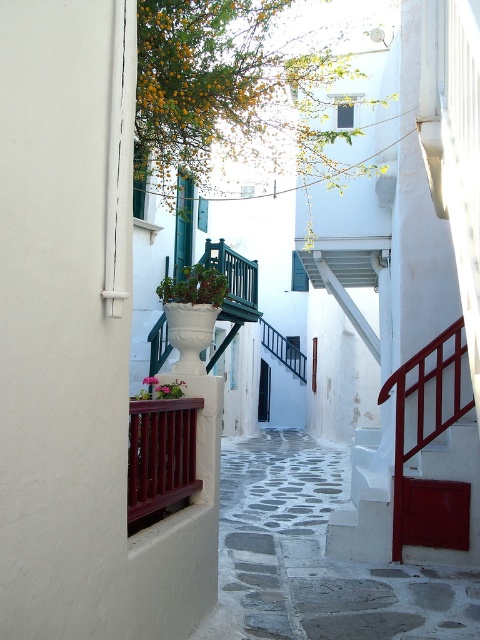
The image size is (480, 640). What do you see at coordinates (160, 458) in the screenshot?
I see `wooden balustrade at lower left` at bounding box center [160, 458].

Can you confirm if wooden balustrade at lower left is wider than metallic red railing at center?

In fact, wooden balustrade at lower left might be narrower than metallic red railing at center.

Where is `wooden balustrade at lower left`? The image size is (480, 640). wooden balustrade at lower left is located at coordinates (160, 458).

Is wooden balustrade at lower left positioned behind matte white pot at center?

That is False.

Which of these two, wooden balustrade at lower left or matte white pot at center, stands shorter?

matte white pot at center

You are a GUI agent. You are given a task and a screenshot of the screen. Output one action in this format:
    pyautogui.click(x=<x>, y=<y>)
    Task: Click on the wooden balustrade at lower left
    
    Given the screenshot: What is the action you would take?
    pyautogui.click(x=160, y=458)

The height and width of the screenshot is (640, 480). In order to click on wooden balustrade at lower left in this screenshot , I will do `click(160, 458)`.

Who is higher up, metallic red railing at center or matte white pot at center?

matte white pot at center is higher up.

Can you confirm if metallic red railing at center is wider than matte white pot at center?

Correct, the width of metallic red railing at center exceeds that of matte white pot at center.

Describe the element at coordinates (284, 349) in the screenshot. The width and height of the screenshot is (480, 640). I see `metallic red railing at center` at that location.

Identify the location of metallic red railing at center. Image resolution: width=480 pixels, height=640 pixels. (284, 349).